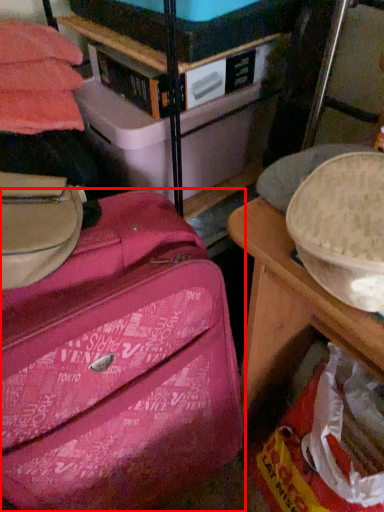
Question: From the image's perspective, where is suitcase (annotated by the red box) located relative to storage box?

Choices:
 (A) below
 (B) above

Answer: (A)